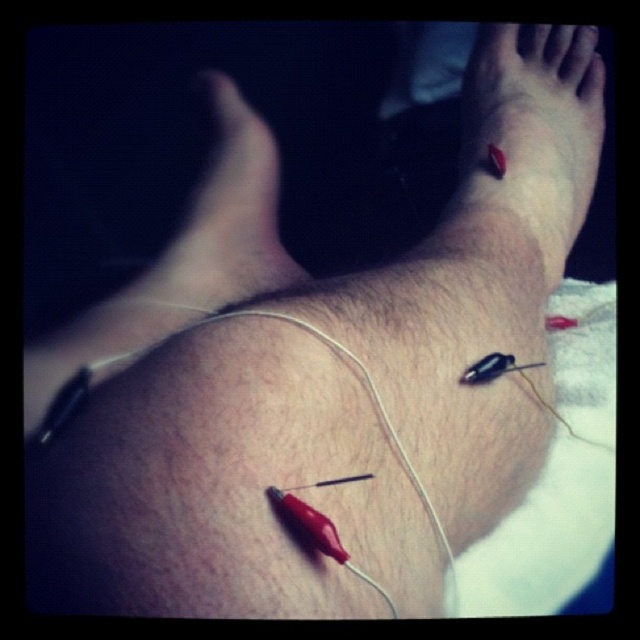
You are a medical technician observing the acupuncture needles on the leg. You need to adjust the position of the device connected to the wires coming from the needles. The device must be placed at least 24 inches away from the patient to avoid interference. Is the current position of the device, which is at point (464, 145), compliant with this requirement?

The point (464, 145) is 23.47 inches from the camera, which is less than the required 24 inches. Therefore, the device is too close and does not comply with the requirement.

You are a medical assistant preparing to secure the wires from the electroacupuncture needles. You have a red rubber band at upper right and a matte skin foot at center in your view. Which object can you use to tie the wires together without slipping?

The red rubber band at upper right is bigger than the matte skin foot at center, so you can use the red rubber band at upper right to tie the wires together securely without slipping.